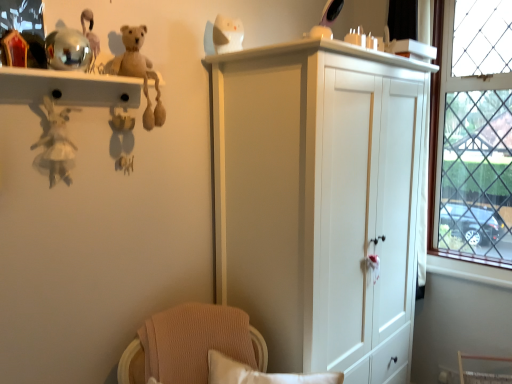
Question: Based on their sizes in the image, would you say white glossy cat at upper center, which ranks as the fourth toy in left-to-right order, is bigger or smaller than metallic reflective shelf at upper left?

Choices:
 (A) small
 (B) big

Answer: (A)

Question: Based on their positions, is white glossy cat at upper center, acting as the second toy starting from the right, located to the left or right of metallic reflective shelf at upper left?

Choices:
 (A) left
 (B) right

Answer: (B)

Question: Which of these objects is positioned closest to the beige plush bear at upper left, which is the 3th toy in left-to-right order?

Choices:
 (A) clear glass window at right
 (B) metallic reflective shelf at upper left
 (C) white glossy cat at upper center, acting as the second toy starting from the right
 (D) shiny plastic mirror at upper center, which is counted as the first toy, starting from the right
 (E) metallic gold toy at upper left, the second toy when ordered from left to right

Answer: (B)

Question: Which object is the closest to the beige plush bear at upper left, which is the 3th toy in left-to-right order?

Choices:
 (A) white glossy cat at upper center, which ranks as the fourth toy in left-to-right order
 (B) clear glass window at right
 (C) white fabric doll at left, the 5th toy viewed from the right
 (D) metallic gold toy at upper left, the second toy when ordered from left to right
 (E) shiny plastic mirror at upper center, which is counted as the first toy, starting from the right

Answer: (D)